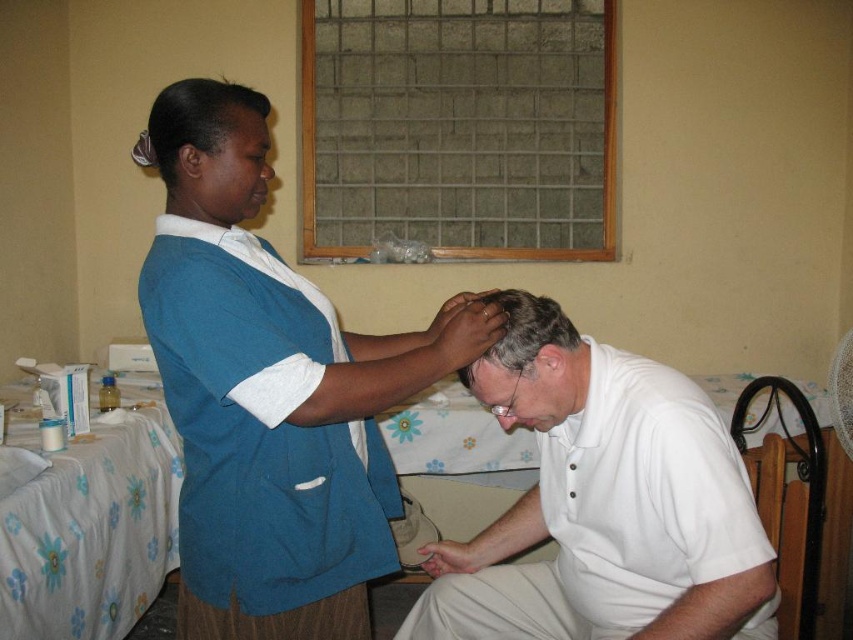
Based on the photo, you are a security camera in the room. You need to locate the matte blue uniform at upper left. What are its coordinates?

The coordinates of the matte blue uniform at upper left are at point (209,148).

You are a security guard in the facility and need to locate the teal fabric uniform at center. Where exactly is it positioned in the room?

The teal fabric uniform at center is located at point (271, 390) in the room.

You are a maintenance worker in the facility and need to reach a point marked at coordinates point (201, 156). Your ladder can extend up to 4 feet. Is your ladder tall enough to reach that point?

The distance of point (201, 156) from camera is 4.22 feet, so the ladder that can extend up to 4 feet is not tall enough to reach that point.